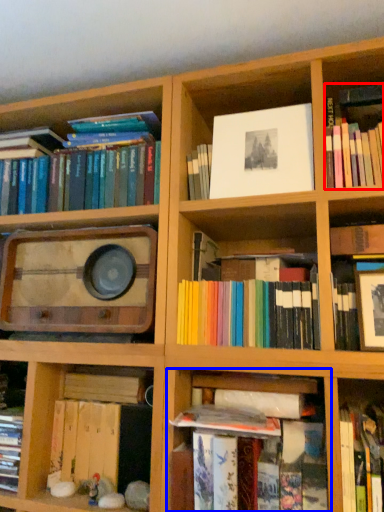
Question: Among these objects, which one is farthest to the camera, book (highlighted by a red box) or shelf (highlighted by a blue box)?

Choices:
 (A) book
 (B) shelf

Answer: (A)